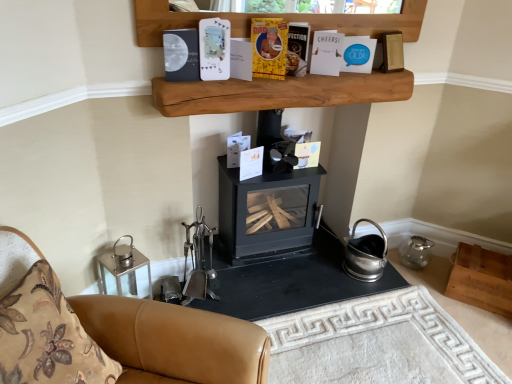
Question: Relative to natural wood shelf at upper center, the 1th shelf when ordered from left to right, is black matte wood burning stove at center in front or behind?

Choices:
 (A) front
 (B) behind

Answer: (B)

Question: From a real-world perspective, relative to natural wood shelf at upper center, which is the second shelf from bottom to top, is black matte wood burning stove at center vertically above or below?

Choices:
 (A) below
 (B) above

Answer: (A)

Question: Which is nearer to the yellow paper-covered book at upper center, placed as the 3th paperback book when sorted from right to left?

Choices:
 (A) white matte paper at upper center, which is the 2th paperback book from left to right
 (B) floral fabric cushion at lower left
 (C) blue paper at upper center, the 6th paperback book positioned from the left
 (D) black matte wood burning stove at center
 (E) brown leather couch at lower left

Answer: (C)

Question: Which object is the closest to the floral fabric cushion at lower left?

Choices:
 (A) black matte wood burning stove at center
 (B) matte black book at upper center, which is the sixth paperback book in right-to-left order
 (C) blue paper at upper center, the 6th paperback book positioned from the left
 (D) white matte paper at upper center, positioned as the 5th paperback book in right-to-left order
 (E) brown leather couch at lower left

Answer: (E)